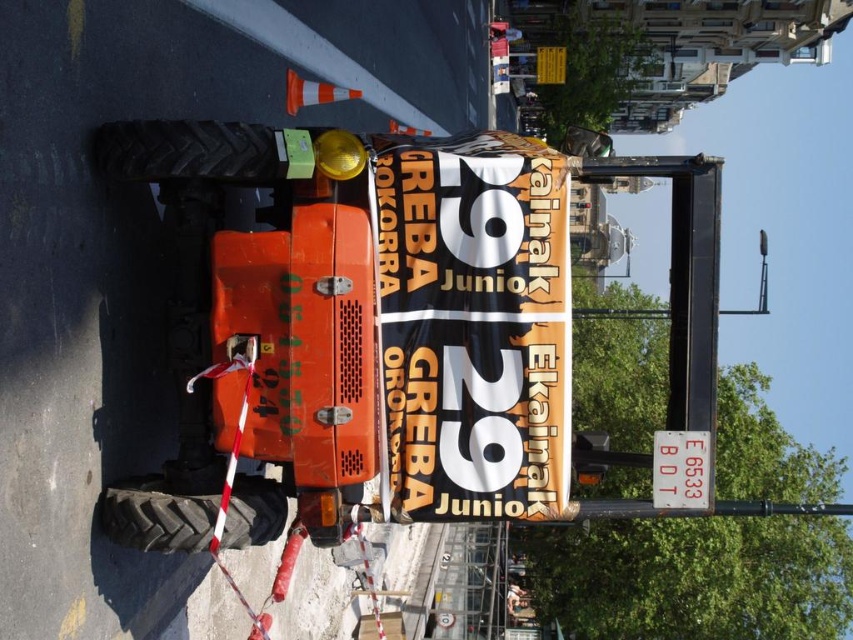
Who is more forward, (543,451) or (706,500)?

Point (543,451) is more forward.

This screenshot has width=853, height=640. Describe the element at coordinates (473, 333) in the screenshot. I see `orange vinyl banner at center` at that location.

In order to click on orange vinyl banner at center in this screenshot , I will do `click(473, 333)`.

Based on the photo, which is above, orange vinyl banner at center or metallic silver ladder at lower center?

Positioned higher is orange vinyl banner at center.

Locate an element on the screen. The width and height of the screenshot is (853, 640). orange vinyl banner at center is located at coordinates (473, 333).

Where is `orange vinyl banner at center`? This screenshot has width=853, height=640. orange vinyl banner at center is located at coordinates [x=473, y=333].

Is black rubber tire at left wider than metallic silver ladder at lower center?

No.

Is black rubber tire at left to the right of metallic silver ladder at lower center from the viewer's perspective?

In fact, black rubber tire at left is to the left of metallic silver ladder at lower center.

This screenshot has width=853, height=640. What do you see at coordinates (189, 150) in the screenshot?
I see `black rubber tire at left` at bounding box center [189, 150].

I want to click on black rubber tire at left, so click(x=189, y=150).